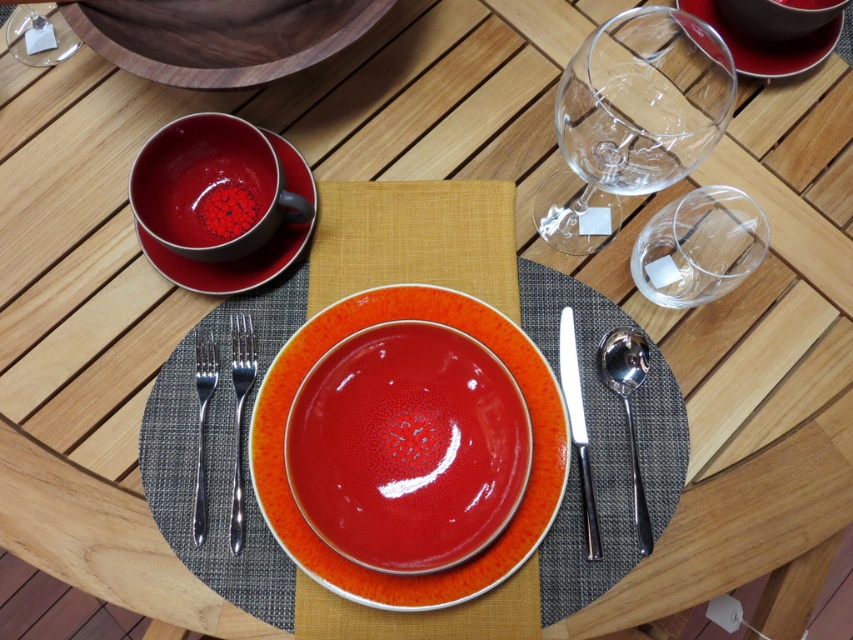
Question: Which point is farther to the camera?

Choices:
 (A) (202, 209)
 (B) (740, 32)
 (C) (234, 330)
 (D) (633, 504)

Answer: (B)

Question: Where is matte red bowl at upper right located in relation to matte ceramic bowl at center in the image?

Choices:
 (A) right
 (B) left

Answer: (B)

Question: Considering the real-world distances, which object is farthest from the glossy ceramic bowl at upper center?

Choices:
 (A) matte red bowl at upper right
 (B) silver metallic fork at left

Answer: (A)

Question: In this image, where is textured gray placemat at center located relative to matte ceramic plate at upper right?

Choices:
 (A) right
 (B) left

Answer: (B)

Question: Does glossy ceramic bowl at upper center have a lesser width compared to silver metallic fork at left?

Choices:
 (A) no
 (B) yes

Answer: (A)

Question: Which point appears closest to the camera in this image?

Choices:
 (A) (236, 208)
 (B) (827, 4)
 (C) (154, 3)
 (D) (430, 285)

Answer: (D)